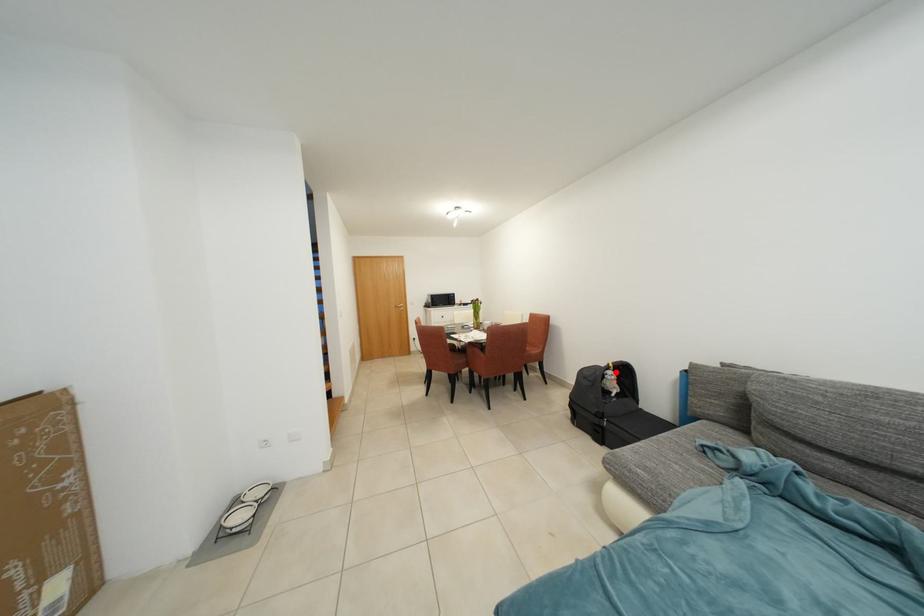
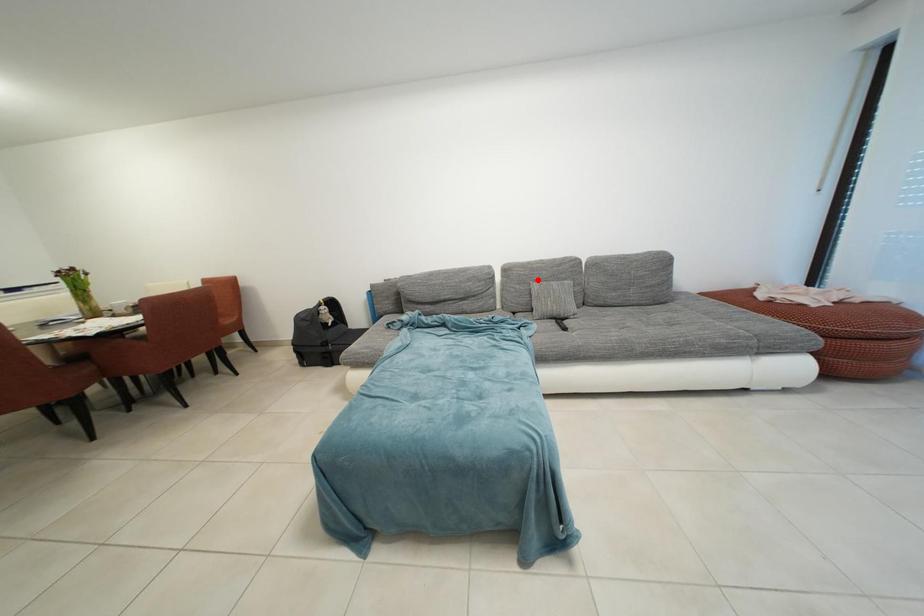
I am providing you with two images of the same scene from different viewpoints. A red point is marked on the first image and another point is marked on the second image. Do the highlighted points in image1 and image2 indicate the same real-world spot?

No